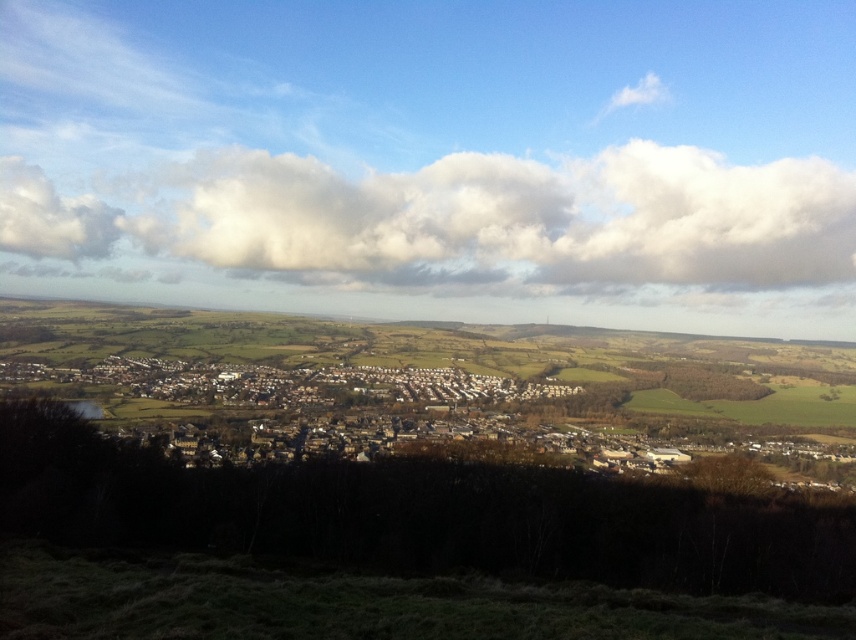
What are the coordinates of the white fluffy cloud at upper center in the image?

The white fluffy cloud at upper center is located at coordinates point (449,221).

You are an airplane passenger looking out the window and see the white fluffy cloud at upper center and the white matte buildings at center. Which object is more to the left?

The white fluffy cloud at upper center is more to the left side of the white matte buildings at center.

Consider the image. You are an architect designing a new town layout. You observe the white fluffy cloud at upper center and the white matte buildings at center in the scene. Which object takes up more space in the image?

The white matte buildings at center take up more space in the image than the white fluffy cloud at upper center because the cloud is smaller than the buildings.